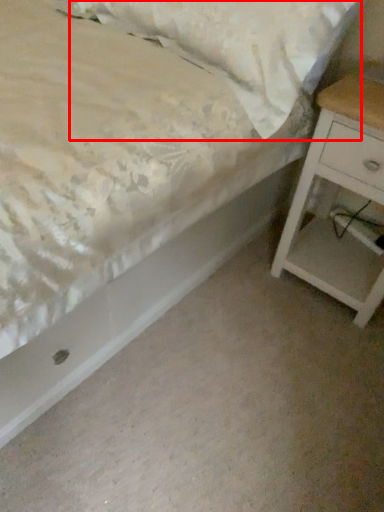
Question: Observing the image, what is the correct spatial positioning of pillow (annotated by the red box) in reference to nightstand?

Choices:
 (A) right
 (B) left

Answer: (B)